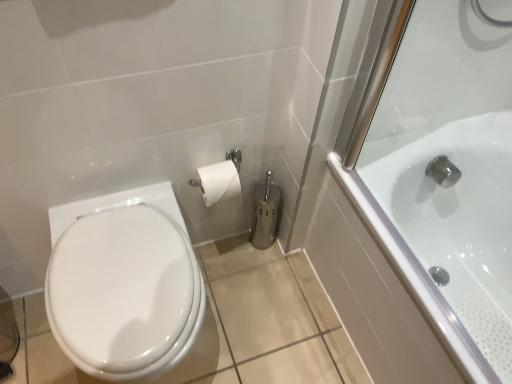
Question: Considering the positions of white glossy bathtub at right and white glossy bidet at lower left in the image, is white glossy bathtub at right wider or thinner than white glossy bidet at lower left?

Choices:
 (A) wide
 (B) thin

Answer: (A)

Question: Based on their positions, is white glossy bathtub at right located to the left or right of white glossy bidet at lower left?

Choices:
 (A) right
 (B) left

Answer: (A)

Question: Considering the positions of point (473, 185) and point (134, 365), is point (473, 185) closer or farther from the camera than point (134, 365)?

Choices:
 (A) closer
 (B) farther

Answer: (B)

Question: From a real-world perspective, relative to white glossy bathtub at right, is white glossy bidet at lower left vertically above or below?

Choices:
 (A) below
 (B) above

Answer: (B)

Question: Which is correct: white glossy bidet at lower left is inside white glossy bathtub at right, or outside of it?

Choices:
 (A) inside
 (B) outside

Answer: (B)

Question: Relative to white glossy bathtub at right, is white glossy bidet at lower left in front or behind?

Choices:
 (A) behind
 (B) front

Answer: (A)

Question: Is point (116, 258) positioned closer to the camera than point (457, 160)?

Choices:
 (A) farther
 (B) closer

Answer: (B)